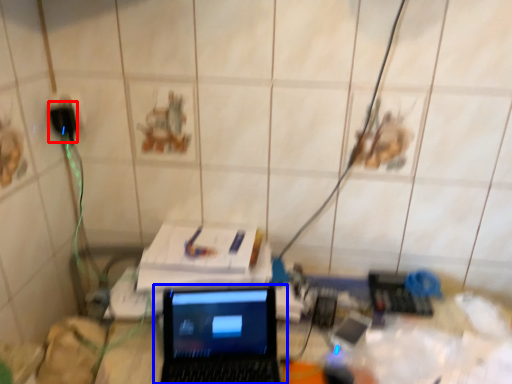
Question: Which object appears farthest to the camera in this image, plug (highlighted by a red box) or laptop (highlighted by a blue box)?

Choices:
 (A) plug
 (B) laptop

Answer: (A)